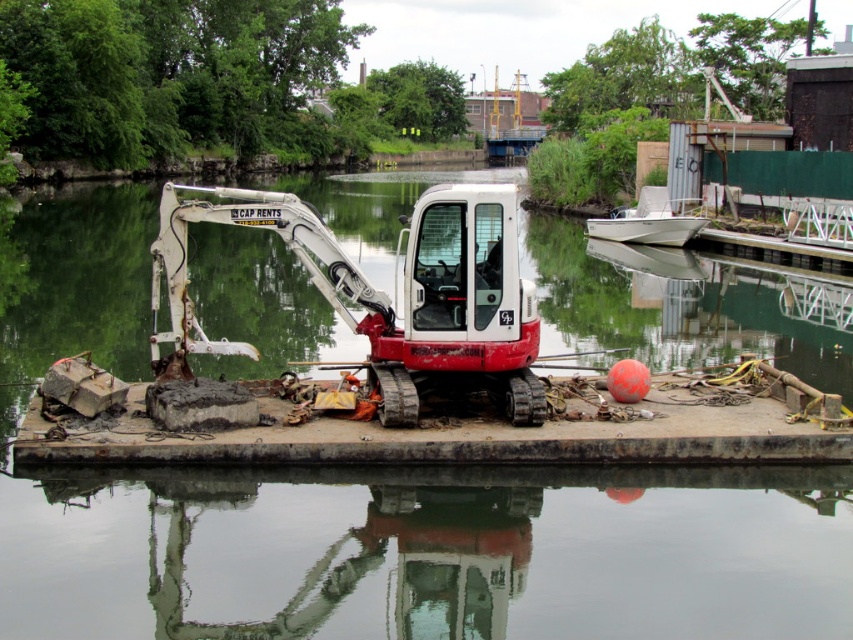
Is rusty concrete dock at center below matte white/red excavator at center?

Indeed, rusty concrete dock at center is positioned under matte white/red excavator at center.

Is rusty concrete dock at center positioned before matte white/red excavator at center?

That is True.

Is point (582, 403) farther from camera compared to point (433, 291)?

Yes, point (582, 403) is farther from viewer.

At what (x,y) coordinates should I click in order to perform the action: click on rusty concrete dock at center. Please return your answer as a coordinate pair (x, y). The height and width of the screenshot is (640, 853). Looking at the image, I should click on (482, 428).

Between point (326, 525) and point (497, 340), which one is positioned behind?

Point (497, 340)

Is green reflective water at center to the left of matte white/red excavator at center from the viewer's perspective?

In fact, green reflective water at center is to the right of matte white/red excavator at center.

Where is `green reflective water at center`? This screenshot has width=853, height=640. green reflective water at center is located at coordinates (427, 552).

The height and width of the screenshot is (640, 853). What are the coordinates of `green reflective water at center` in the screenshot? It's located at (427, 552).

Which is below, matte white/red excavator at center or white matte boat at upper right?

Positioned lower is white matte boat at upper right.

Between point (474, 257) and point (700, 221), which one is positioned behind?

The point (700, 221) is behind.

What are the coordinates of `matte white/red excavator at center` in the screenshot? It's located at (384, 292).